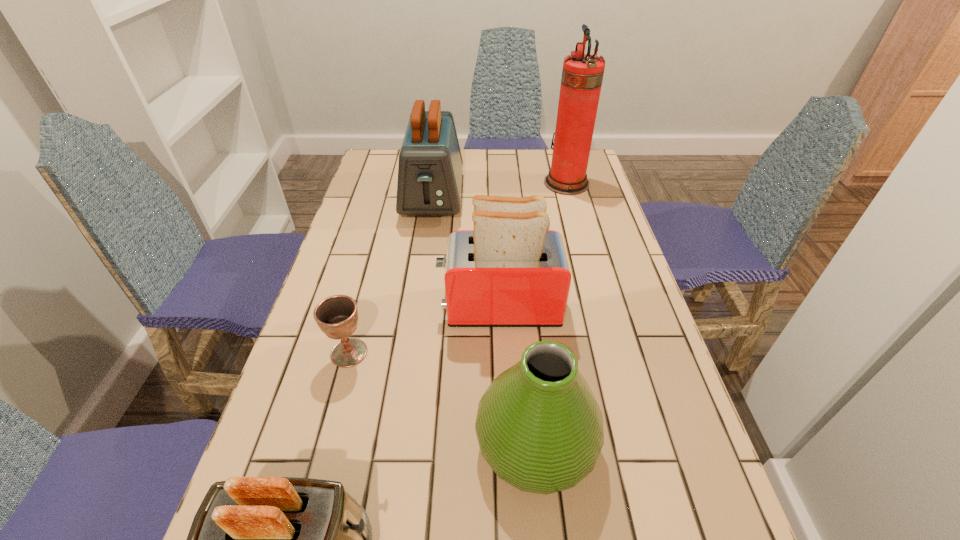
Select which toaster is the closest to the fourth nearest object. Please provide its 2D coordinates. Your answer should be formatted as a tuple, i.e. [(x, y)], where the tuple contains the x and y coordinates of a point satisfying the conditions above.

[(430, 166)]

At what (x,y) coordinates should I click in order to perform the action: click on blank space that satisfies the following two spatial constraints: 1. on the front side of the vase; 2. on the left side of the shortest object. Please return your answer as a coordinate pair (x, y). Looking at the image, I should click on (324, 443).

At what (x,y) coordinates should I click in order to perform the action: click on vacant space that satisfies the following two spatial constraints: 1. on the front-facing side of the third farthest object; 2. on the front side of the chalice. Please return your answer as a coordinate pair (x, y). This screenshot has height=540, width=960. Looking at the image, I should click on (501, 353).